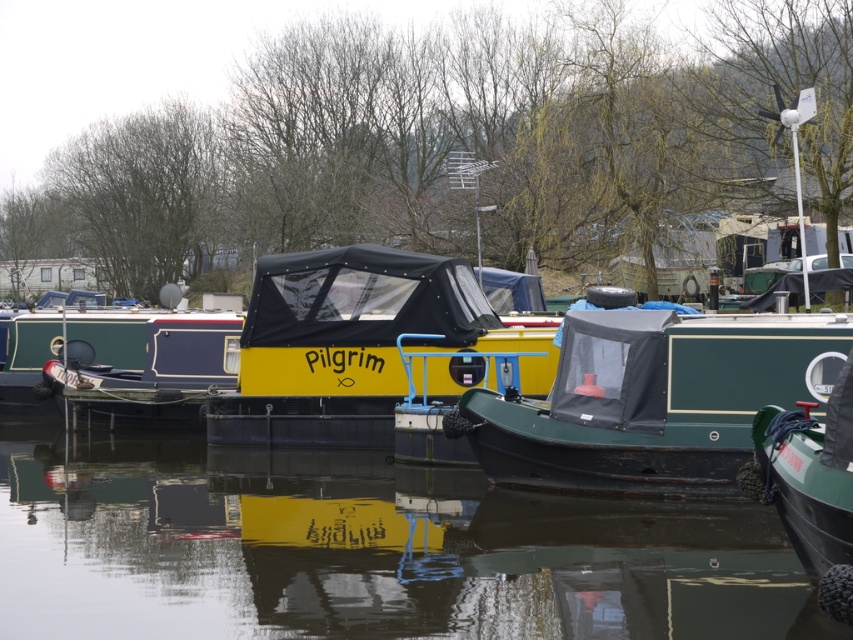
Question: Is green matte boat at center further to the viewer compared to green matte canal boat at center?

Choices:
 (A) no
 (B) yes

Answer: (A)

Question: Which object is closer to the camera taking this photo?

Choices:
 (A) green matte boat at center
 (B) green matte boat at right

Answer: (B)

Question: Which of the following is the closest to the observer?

Choices:
 (A) green matte boat at right
 (B) yellow matte boat at center
 (C) green matte canal boat at center

Answer: (A)

Question: Is green matte canal boat at center wider than green matte boat at right?

Choices:
 (A) no
 (B) yes

Answer: (B)

Question: Which point is farther to the camera?

Choices:
 (A) (9, 460)
 (B) (90, 396)

Answer: (B)

Question: Is transparent water at center further to camera compared to green matte canal boat at center?

Choices:
 (A) no
 (B) yes

Answer: (A)